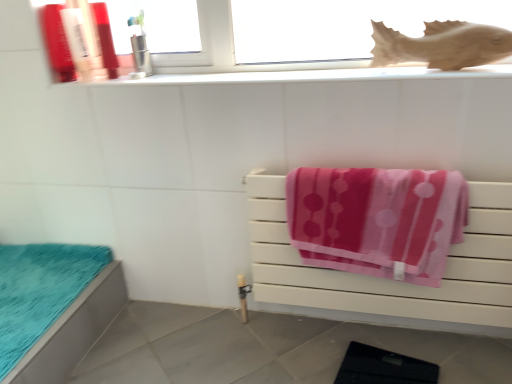
At what (x,y) coordinates should I click in order to perform the action: click on free space above pink fabric towel at center (from a real-world perspective). Please return your answer as a coordinate pair (x, y). Looking at the image, I should click on (375, 166).